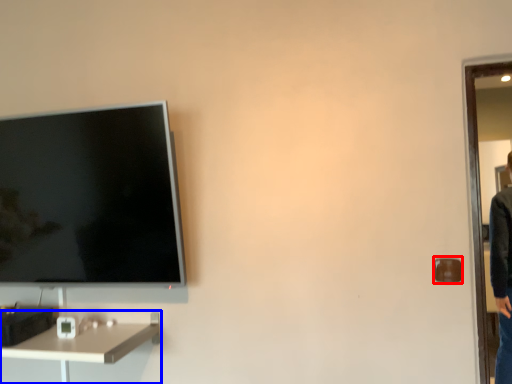
Question: Which object appears farthest to the camera in this image, door handle (highlighted by a red box) or desk (highlighted by a blue box)?

Choices:
 (A) door handle
 (B) desk

Answer: (A)